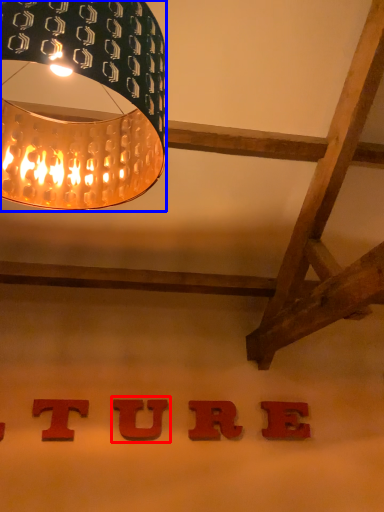
Question: Which of the following is the farthest to the observer, alphabet (highlighted by a red box) or lamp (highlighted by a blue box)?

Choices:
 (A) alphabet
 (B) lamp

Answer: (A)